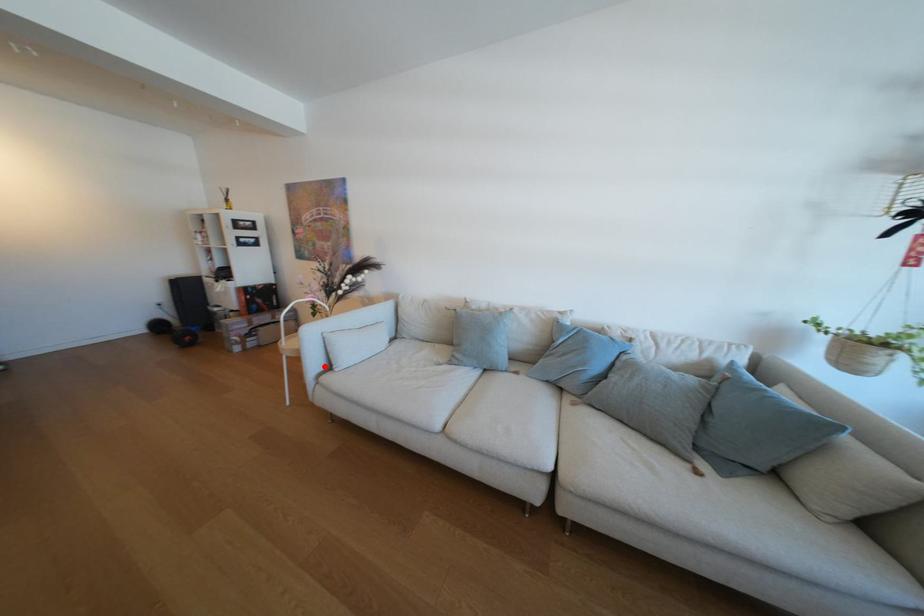
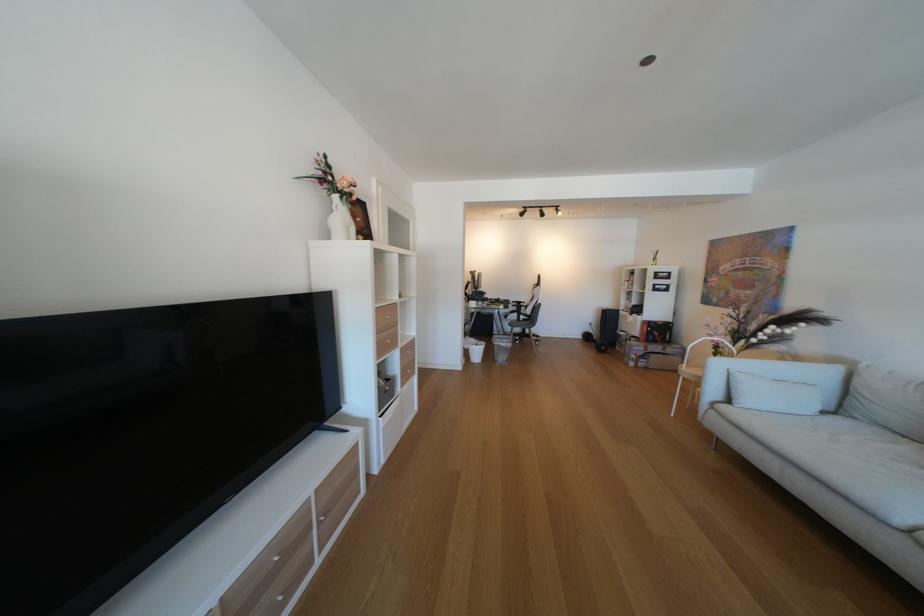
Where in the second image is the point corresponding to the highlighted location from the first image?

(723, 392)